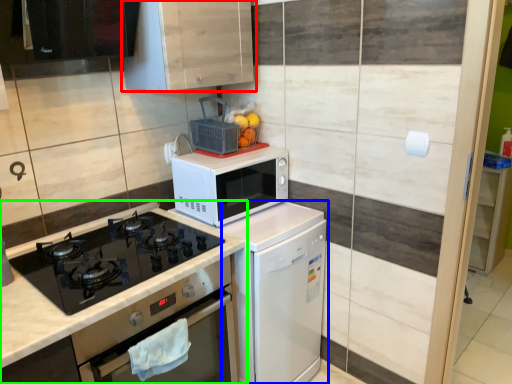
Question: Based on their relative distances, which object is farther from cabinetry (highlighted by a red box)? Choose from dish washer (highlighted by a blue box) and countertop (highlighted by a green box).

Choices:
 (A) dish washer
 (B) countertop

Answer: (A)